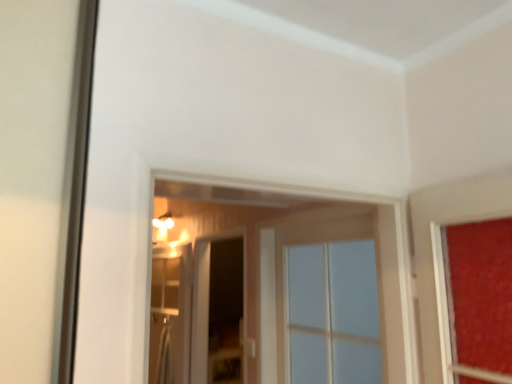
Question: Is clear glass window at center wider than clear glass screen door at center, which ranks as the second screen door in left-to-right order?

Choices:
 (A) no
 (B) yes

Answer: (B)

Question: Does clear glass window at center have a lesser width compared to clear glass screen door at center, marked as the 1th screen door in a right-to-left arrangement?

Choices:
 (A) yes
 (B) no

Answer: (B)

Question: Is clear glass window at center to the right of clear glass screen door at center, which ranks as the second screen door in left-to-right order, from the viewer's perspective?

Choices:
 (A) yes
 (B) no

Answer: (A)

Question: Is clear glass window at center shorter than clear glass screen door at center, marked as the 1th screen door in a right-to-left arrangement?

Choices:
 (A) no
 (B) yes

Answer: (B)

Question: Would you say clear glass window at center contains clear glass screen door at center, marked as the 1th screen door in a right-to-left arrangement?

Choices:
 (A) yes
 (B) no

Answer: (B)

Question: From the image's perspective, is clear glass screen door at center, which ranks as the second screen door in left-to-right order, located above or below clear glass window at center?

Choices:
 (A) above
 (B) below

Answer: (B)

Question: Is point (203, 253) closer or farther from the camera than point (287, 369)?

Choices:
 (A) closer
 (B) farther

Answer: (B)

Question: From a real-world perspective, is clear glass screen door at center, which ranks as the second screen door in left-to-right order, positioned above or below clear glass window at center?

Choices:
 (A) above
 (B) below

Answer: (B)

Question: Would you say clear glass screen door at center, marked as the 1th screen door in a right-to-left arrangement, is inside or outside clear glass window at center?

Choices:
 (A) inside
 (B) outside

Answer: (B)

Question: Relative to clear glass screen door at center, placed as the 1th screen door when sorted from left to right, is clear glass window at center in front or behind?

Choices:
 (A) behind
 (B) front

Answer: (B)

Question: From a real-world perspective, is clear glass window at center positioned above or below clear glass screen door at center, arranged as the second screen door when viewed from the right?

Choices:
 (A) above
 (B) below

Answer: (A)

Question: Considering the positions of clear glass window at center and clear glass screen door at center, arranged as the second screen door when viewed from the right, in the image, is clear glass window at center taller or shorter than clear glass screen door at center, arranged as the second screen door when viewed from the right,?

Choices:
 (A) tall
 (B) short

Answer: (B)

Question: From the image's perspective, is clear glass window at center located above or below clear glass screen door at center, arranged as the second screen door when viewed from the right?

Choices:
 (A) below
 (B) above

Answer: (B)

Question: Would you say clear glass screen door at center, arranged as the second screen door when viewed from the right, is to the left or to the right of clear glass screen door at center, which ranks as the second screen door in left-to-right order, in the picture?

Choices:
 (A) right
 (B) left

Answer: (B)

Question: Does point (157, 357) appear closer or farther from the camera than point (203, 276)?

Choices:
 (A) farther
 (B) closer

Answer: (A)